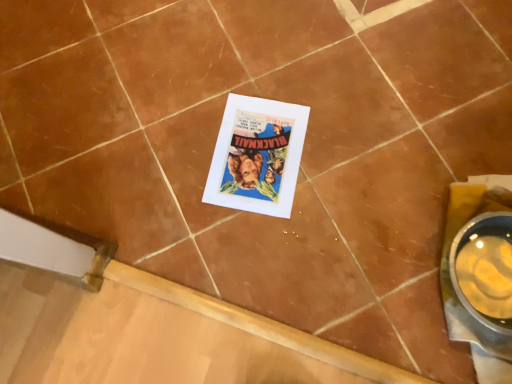
Image resolution: width=512 pixels, height=384 pixels. Describe the element at coordinates (257, 156) in the screenshot. I see `matte paper poster at center` at that location.

Measure the distance between matte paper poster at center and camera.

97.25 centimeters.

Locate an element on the screen. Image resolution: width=512 pixels, height=384 pixels. matte paper poster at center is located at coordinates (257, 156).

The width and height of the screenshot is (512, 384). I want to click on matte paper poster at center, so click(257, 156).